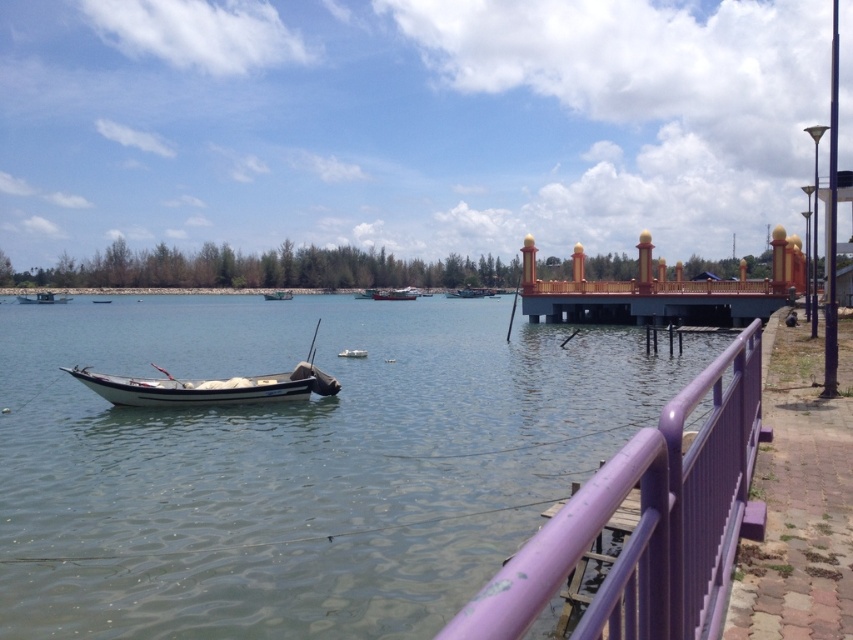
You are standing on the shore and see two points in the water. The first point is labeled as point (292, 296) and the second is point (347, 348). Which point is farther away from the shore?

Point (292, 296) is behind point (347, 348), so it is farther away from the shore.

You are planning to dock your boat at the waterfront. You see a green matte boat at center and a white matte boat at center. Which boat has a larger width?

The green matte boat at center might be wider than the white matte boat at center.